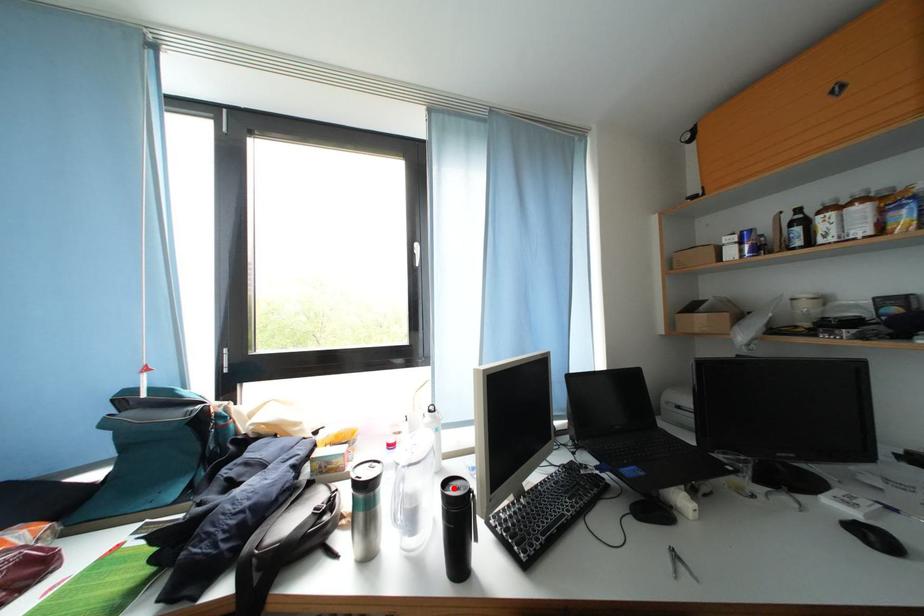
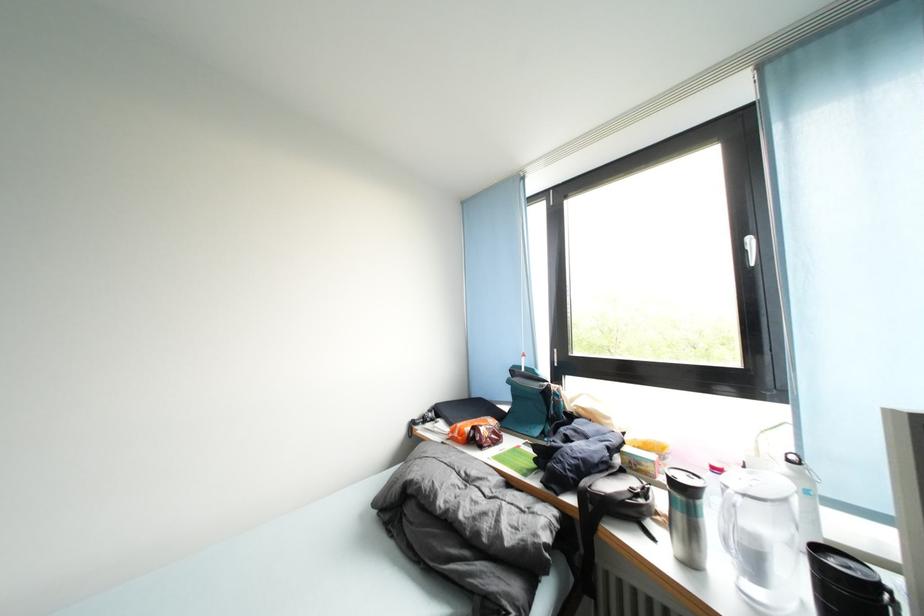
Find the pixel in the second image that matches the highlighted location in the first image.

(825, 552)